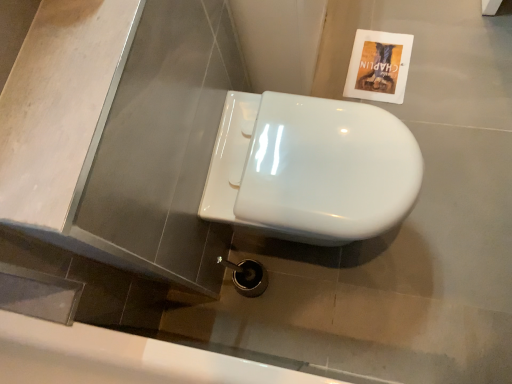
Locate an element on the screen. The width and height of the screenshot is (512, 384). vacant area that is in front of matte paper flyer at upper right is located at coordinates (426, 102).